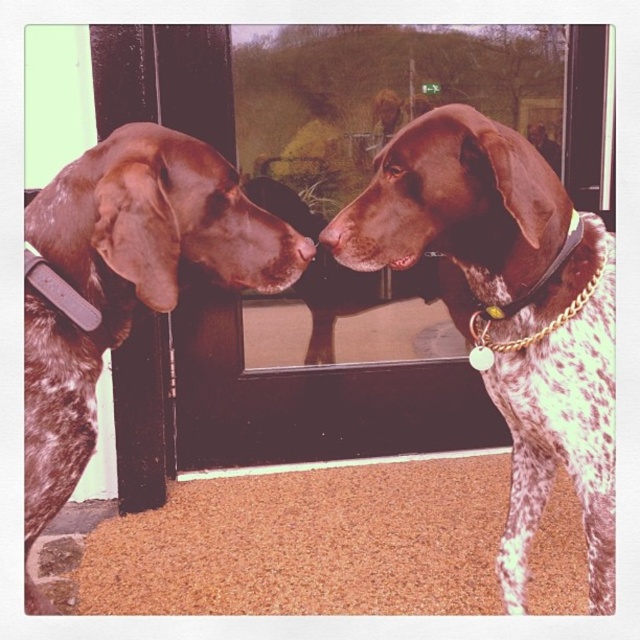
This screenshot has height=640, width=640. Identify the location of transparent glass window at center. (376, 99).

Which is more to the right, transparent glass window at center or brown leather nose at center?

transparent glass window at center

Locate an element on the screen. This screenshot has height=640, width=640. transparent glass window at center is located at coordinates (376, 99).

Where is `transparent glass window at center`? transparent glass window at center is located at coordinates (376, 99).

Identify the location of transparent glass window at center. This screenshot has height=640, width=640. (376, 99).

Who is more forward, (401, 289) or (520, 300)?

Point (520, 300)

In order to click on transparent glass window at center in this screenshot , I will do `click(376, 99)`.

Does speckled brown dog at left lie in front of transparent glass window at center?

That is True.

Who is more distant from viewer, (109, 168) or (371, 44)?

The point (371, 44) is more distant.

I want to click on speckled brown dog at left, so click(x=122, y=282).